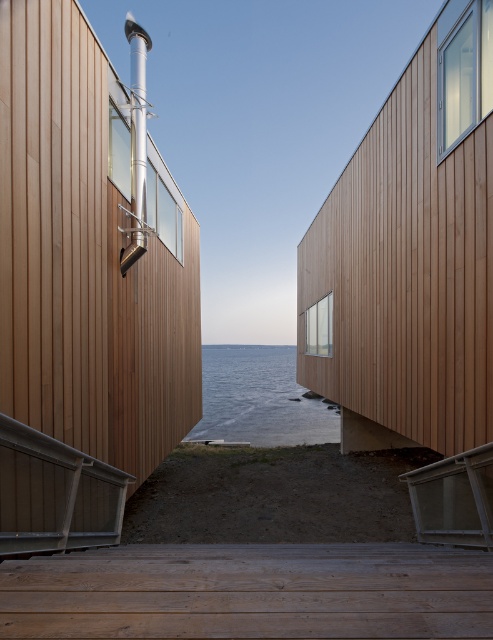
Based on the photo, can you confirm if metallic gray balustrade at lower left is wider than transparent water at center?

Incorrect, metallic gray balustrade at lower left's width does not surpass transparent water at center's.

Identify the location of metallic gray balustrade at lower left. (55, 493).

What do you see at coordinates (55, 493) in the screenshot? This screenshot has width=493, height=640. I see `metallic gray balustrade at lower left` at bounding box center [55, 493].

Locate an element on the screen. The width and height of the screenshot is (493, 640). metallic gray balustrade at lower left is located at coordinates (55, 493).

Which is above, wooden planks at center or metallic gray balustrade at lower left?

metallic gray balustrade at lower left is higher up.

Is wooden planks at center positioned before metallic gray balustrade at lower left?

Yes, it is.

Measure the distance between point (59, 557) and camera.

3.45 meters

The image size is (493, 640). What are the coordinates of `wooden planks at center` in the screenshot? It's located at (249, 593).

Is wooden planks at center to the right of transparent water at center from the viewer's perspective?

Correct, you'll find wooden planks at center to the right of transparent water at center.

Who is more forward, (232, 580) or (267, 365)?

Point (232, 580) is in front.

Is point (187, 550) closer to viewer compared to point (225, 344)?

Yes, it is.

Find the location of `wooden planks at center`. wooden planks at center is located at coordinates (249, 593).